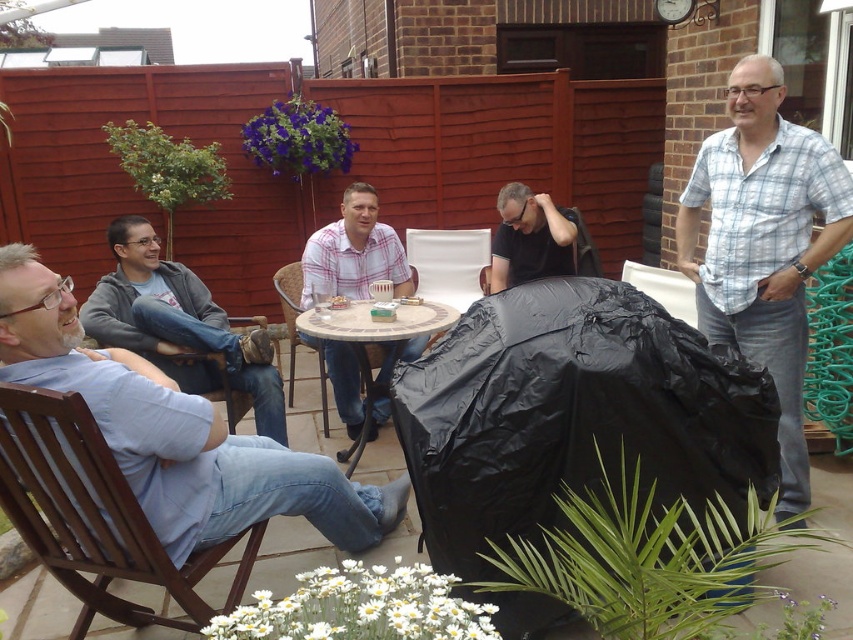
You are a photographer standing at the edge of the patio. You need to capture a photo of the light blue denim jeans at lower left and the black plastic chair at center. Which object is taller?

The light blue denim jeans at lower left is taller than the black plastic chair at center.

You are planning to pack your backpack for a short hike and have a gray fleece jacket at left and a white fabric chair at center in your inventory. Which item takes up more space in your backpack?

The gray fleece jacket at left is larger in size than the white fabric chair at center, so it would take up more space in your backpack.